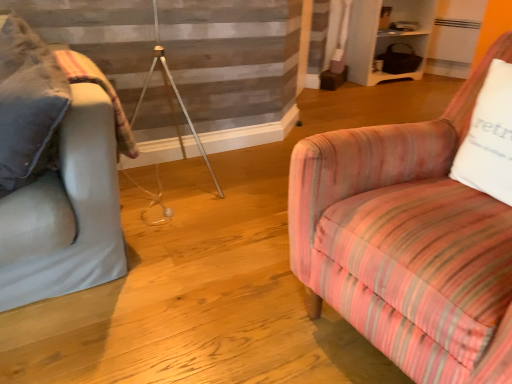
From the picture: Measure the distance between point (511, 150) and camera.

They are 3.58 feet apart.

What do you see at coordinates (66, 212) in the screenshot? I see `light gray fabric couch at left` at bounding box center [66, 212].

You are a GUI agent. You are given a task and a screenshot of the screen. Output one action in this format:
    pyautogui.click(x=<x>, y=<y>)
    Task: Click on the white cotton pillow at right
    This screenshot has width=512, height=384.
    Given the screenshot: What is the action you would take?
    pyautogui.click(x=489, y=138)

From a real-world perspective, is light gray fabric couch at left physically above white cotton pillow at right?

No.

From the image's perspective, is light gray fabric couch at left on top of white cotton pillow at right?

Correct, light gray fabric couch at left appears higher than white cotton pillow at right in the image.

Can you confirm if light gray fabric couch at left is shorter than white cotton pillow at right?

No.

Would you consider light gray fabric couch at left to be distant from pink striped fabric chair at right?

No.

Which object is closer to the camera taking this photo, light gray fabric couch at left or pink striped fabric chair at right?

pink striped fabric chair at right.

This screenshot has width=512, height=384. Find the location of `chair that is below the light gray fabric couch at left (from the image's perspective)`. chair that is below the light gray fabric couch at left (from the image's perspective) is located at coordinates (405, 238).

Considering the relative positions of light gray fabric couch at left and pink striped fabric chair at right in the image provided, is light gray fabric couch at left to the right of pink striped fabric chair at right from the viewer's perspective?

In fact, light gray fabric couch at left is to the left of pink striped fabric chair at right.

Identify the location of studio couch above the pink striped fabric chair at right (from a real-world perspective). (66, 212).

Consider the image. In terms of width, does pink striped fabric chair at right look wider or thinner when compared to light gray fabric couch at left?

In the image, pink striped fabric chair at right appears to be wider than light gray fabric couch at left.

In the scene shown: Is pink striped fabric chair at right smaller than light gray fabric couch at left?

Incorrect, pink striped fabric chair at right is not smaller in size than light gray fabric couch at left.

Is pink striped fabric chair at right not within light gray fabric couch at left?

Indeed, pink striped fabric chair at right is completely outside light gray fabric couch at left.

From the image's perspective, is white cotton pillow at right located above pink striped fabric chair at right?

Yes.

Is white cotton pillow at right positioned before pink striped fabric chair at right?

No, the depth of white cotton pillow at right is greater than that of pink striped fabric chair at right.

What's the angular difference between white cotton pillow at right and pink striped fabric chair at right's facing directions?

The angular difference between white cotton pillow at right and pink striped fabric chair at right is 0.0107 degrees.

Based on the photo, from a real-world perspective, between white cotton pillow at right and pink striped fabric chair at right, who is vertically lower?

pink striped fabric chair at right.

Consider the image. From a real-world perspective, is light gray fabric couch at left located higher than plush beige blanket at left?

Indeed, from a real-world perspective, light gray fabric couch at left stands above plush beige blanket at left.

Who is taller, light gray fabric couch at left or plush beige blanket at left?

With more height is light gray fabric couch at left.

Is light gray fabric couch at left not within plush beige blanket at left?

Absolutely, light gray fabric couch at left is external to plush beige blanket at left.

In the image, is light gray fabric couch at left on the left side or the right side of plush beige blanket at left?

light gray fabric couch at left is to the left of plush beige blanket at left.

Locate an element on the screen. The image size is (512, 384). blanket above the pink striped fabric chair at right (from a real-world perspective) is located at coordinates (104, 90).

Which of these two, plush beige blanket at left or pink striped fabric chair at right, stands shorter?

plush beige blanket at left.

Based on their positions, is plush beige blanket at left located to the left or right of pink striped fabric chair at right?

plush beige blanket at left is to the left of pink striped fabric chair at right.

Would you say pink striped fabric chair at right is inside or outside plush beige blanket at left?

pink striped fabric chair at right is not enclosed by plush beige blanket at left.

Between pink striped fabric chair at right and plush beige blanket at left, which one is positioned in front?

pink striped fabric chair at right is closer to the camera.

From a real-world perspective, is pink striped fabric chair at right physically below plush beige blanket at left?

Yes, from a real-world perspective, pink striped fabric chair at right is under plush beige blanket at left.

Identify the location of studio couch lying in front of the white cotton pillow at right. (66, 212).

Identify the location of studio couch on the left of pink striped fabric chair at right. (66, 212).

When comparing their distances from light gray fabric couch at left, does white cotton pillow at right or pink striped fabric chair at right seem closer?

Among the two, pink striped fabric chair at right is located nearer to light gray fabric couch at left.

Considering their positions, is white cotton pillow at right positioned further to plush beige blanket at left than pink striped fabric chair at right?

white cotton pillow at right.

Looking at the image, which one is located closer to light gray fabric couch at left, plush beige blanket at left or white cotton pillow at right?

The object closer to light gray fabric couch at left is plush beige blanket at left.

From the image, which object appears to be nearer to plush beige blanket at left, pink striped fabric chair at right or white cotton pillow at right?

pink striped fabric chair at right lies closer to plush beige blanket at left than the other object.

Which object lies nearer to the anchor point light gray fabric couch at left, plush beige blanket at left or pink striped fabric chair at right?

Based on the image, plush beige blanket at left appears to be nearer to light gray fabric couch at left.

When comparing their distances from light gray fabric couch at left, does pink striped fabric chair at right or plush beige blanket at left seem closer?

plush beige blanket at left.

From the image, which object appears to be farther from plush beige blanket at left, light gray fabric couch at left or pink striped fabric chair at right?

pink striped fabric chair at right is further to plush beige blanket at left.

Which object lies further to the anchor point white cotton pillow at right, light gray fabric couch at left or pink striped fabric chair at right?

light gray fabric couch at left is further to white cotton pillow at right.

Locate an element on the screen. The width and height of the screenshot is (512, 384). blanket between light gray fabric couch at left and white cotton pillow at right from left to right is located at coordinates (104, 90).

What are the coordinates of `chair situated between plush beige blanket at left and white cotton pillow at right from left to right` in the screenshot? It's located at (405, 238).

At what (x,y) coordinates should I click in order to perform the action: click on chair between light gray fabric couch at left and white cotton pillow at right from left to right. Please return your answer as a coordinate pair (x, y). The image size is (512, 384). Looking at the image, I should click on (405, 238).

Identify the location of blanket between light gray fabric couch at left and pink striped fabric chair at right. (104, 90).